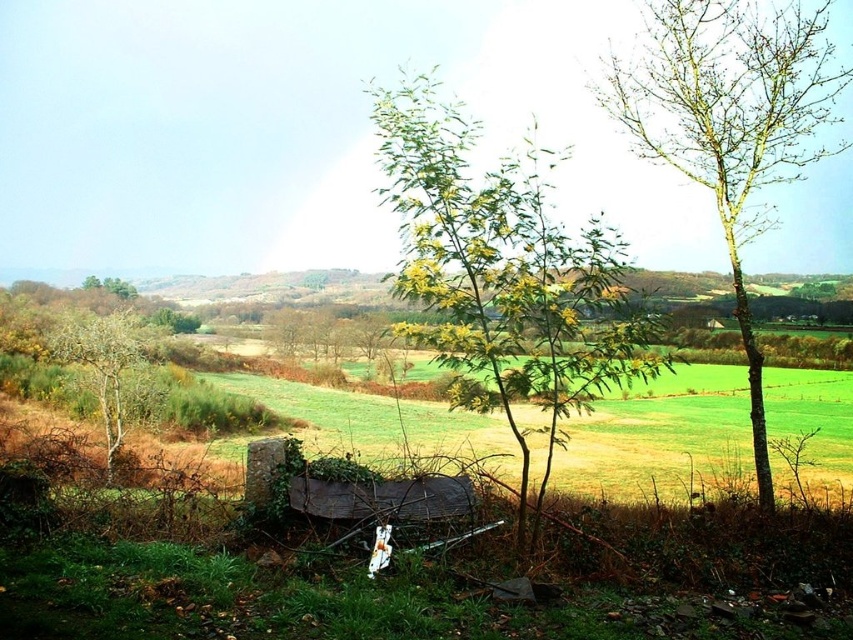
Question: Is green leafy tree at right below smooth brown tree at left?

Choices:
 (A) yes
 (B) no

Answer: (B)

Question: Does green leafy tree at right appear under smooth brown tree at left?

Choices:
 (A) no
 (B) yes

Answer: (A)

Question: Estimate the real-world distances between objects in this image. Which object is farther from the green leafy tree at center?

Choices:
 (A) smooth brown tree at left
 (B) green leafy tree at right

Answer: (A)

Question: Among these points, which one is farthest from the camera?

Choices:
 (A) (769, 177)
 (B) (595, 381)
 (C) (70, 353)

Answer: (C)

Question: Which point is farther to the camera?

Choices:
 (A) (108, 406)
 (B) (807, 68)

Answer: (A)

Question: Does green leafy tree at center have a smaller size compared to smooth brown tree at left?

Choices:
 (A) no
 (B) yes

Answer: (A)